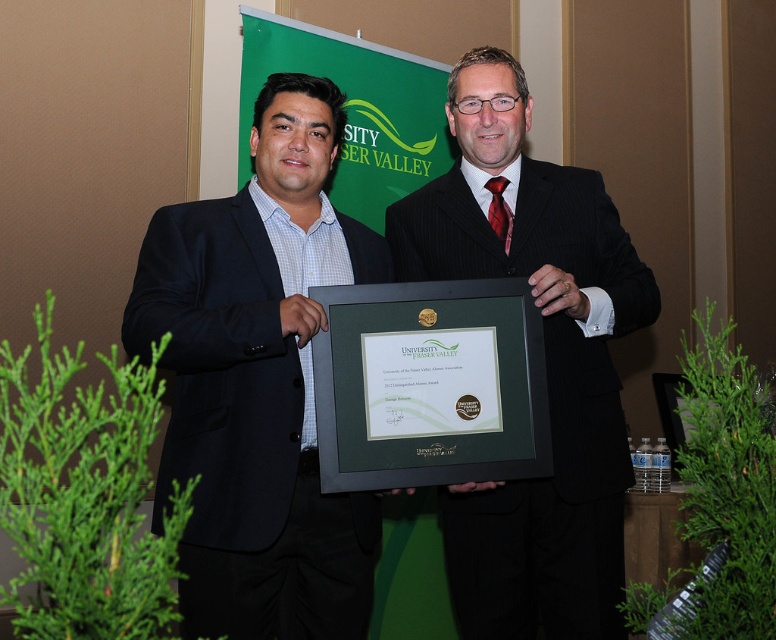
From the picture: You are an event organizer and need to arrange seating for two guests wearing the black pinstripe suit at center and the dark blue fabric business suit at center. Based on their positions in the image, which guest should sit closer to the stage?

The black pinstripe suit at center is located above the dark blue fabric business suit at center in the image, which suggests they are standing closer to the front. Therefore, the guest in the black pinstripe suit at center should sit closer to the stage.

Consider the image. You are standing in the same room as the two men and want to take a photo of the black pinstripe suit at center. Where should you aim your camera to capture it?

You should aim your camera at point 0.630 on the x axis and 0.707 on the y axis to capture the black pinstripe suit at center.

You are standing in front of the two men holding the certificate. Which object corresponds to the point with coordinates (548, 403)?

The point at coordinates (548, 403) corresponds to the black pinstripe suit at center.